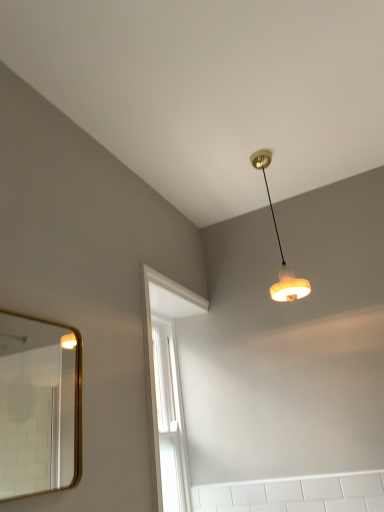
Question: Would you consider matte orange lampshade at upper center to be distant from gold-framed mirror at left?

Choices:
 (A) no
 (B) yes

Answer: (B)

Question: Is matte orange lampshade at upper center at the left side of gold-framed mirror at left?

Choices:
 (A) no
 (B) yes

Answer: (A)

Question: Does matte orange lampshade at upper center have a lesser height compared to gold-framed mirror at left?

Choices:
 (A) no
 (B) yes

Answer: (A)

Question: Considering the relative positions of matte orange lampshade at upper center and gold-framed mirror at left in the image provided, is matte orange lampshade at upper center in front of gold-framed mirror at left?

Choices:
 (A) yes
 (B) no

Answer: (B)

Question: Considering the relative sizes of matte orange lampshade at upper center and gold-framed mirror at left in the image provided, is matte orange lampshade at upper center bigger than gold-framed mirror at left?

Choices:
 (A) yes
 (B) no

Answer: (A)

Question: From the image's perspective, is matte orange lampshade at upper center on gold-framed mirror at left?

Choices:
 (A) yes
 (B) no

Answer: (A)

Question: Does gold-framed mirror at left appear on the right side of matte orange lampshade at upper center?

Choices:
 (A) yes
 (B) no

Answer: (B)

Question: Does gold-framed mirror at left lie in front of matte orange lampshade at upper center?

Choices:
 (A) yes
 (B) no

Answer: (A)

Question: Does gold-framed mirror at left have a greater height compared to matte orange lampshade at upper center?

Choices:
 (A) no
 (B) yes

Answer: (A)

Question: Is gold-framed mirror at left positioned beyond the bounds of matte orange lampshade at upper center?

Choices:
 (A) yes
 (B) no

Answer: (A)

Question: Considering the relative sizes of gold-framed mirror at left and matte orange lampshade at upper center in the image provided, is gold-framed mirror at left bigger than matte orange lampshade at upper center?

Choices:
 (A) yes
 (B) no

Answer: (B)

Question: Could you tell me if gold-framed mirror at left is facing matte orange lampshade at upper center?

Choices:
 (A) yes
 (B) no

Answer: (B)

Question: Considering the positions of gold-framed mirror at left and matte orange lampshade at upper center in the image, is gold-framed mirror at left wider or thinner than matte orange lampshade at upper center?

Choices:
 (A) thin
 (B) wide

Answer: (A)